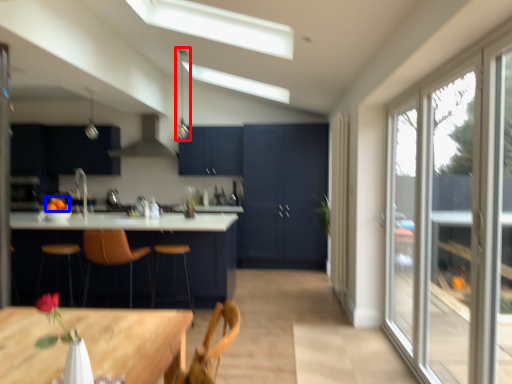
Question: Which object is closer to the camera taking this photo, light fixture (highlighted by a red box) or fruit (highlighted by a blue box)?

Choices:
 (A) light fixture
 (B) fruit

Answer: (B)